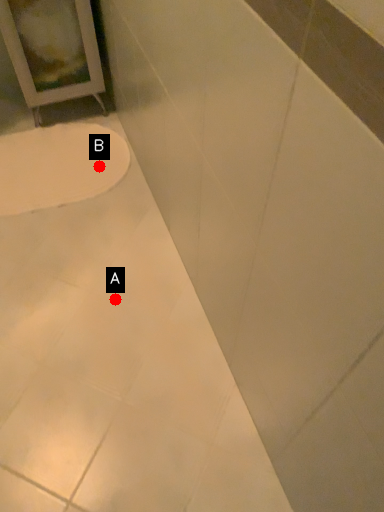
Question: Two points are circled on the image, labeled by A and B beside each circle. Which point appears closest to the camera in this image?

Choices:
 (A) A is closer
 (B) B is closer

Answer: (A)